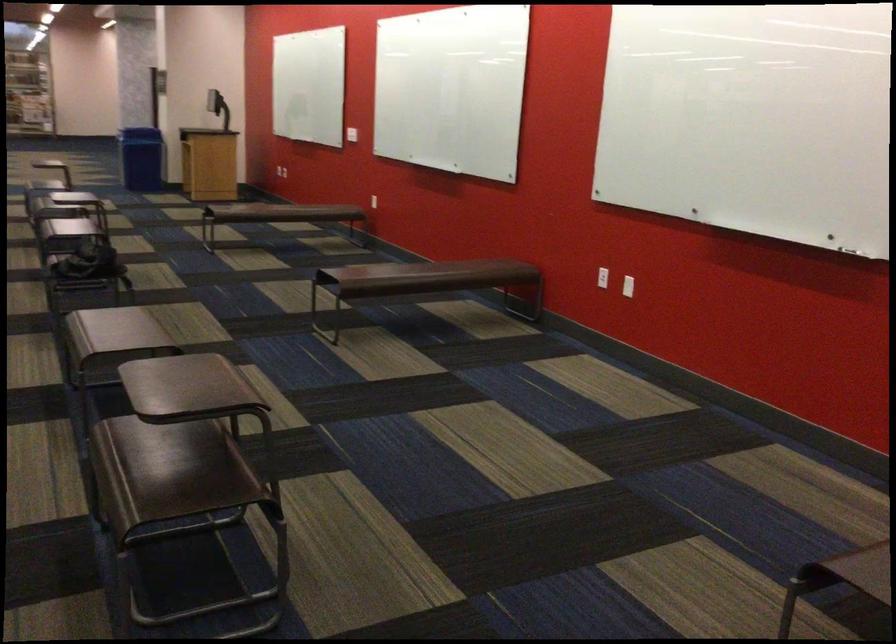
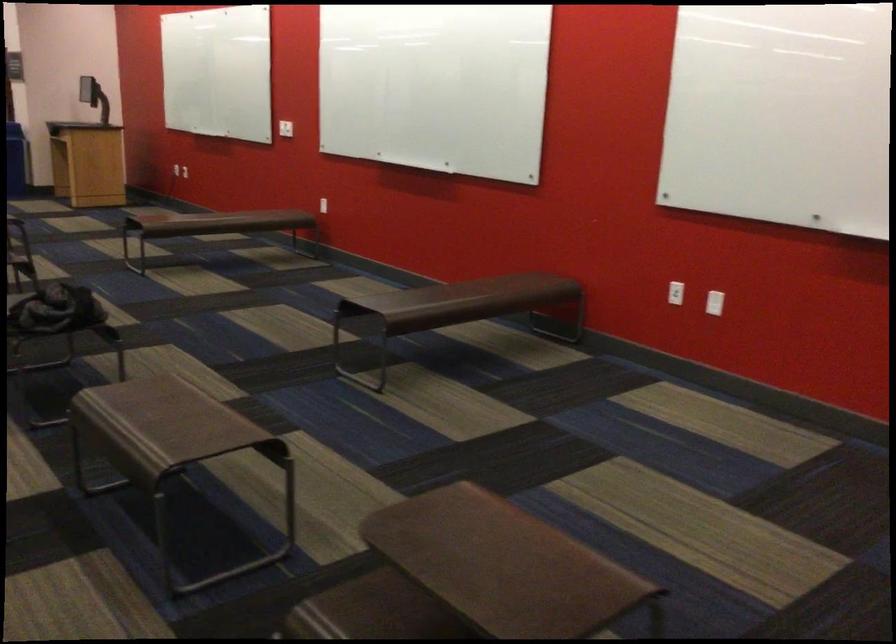
In the second image, find the point that corresponds to (408,281) in the first image.

(453, 308)